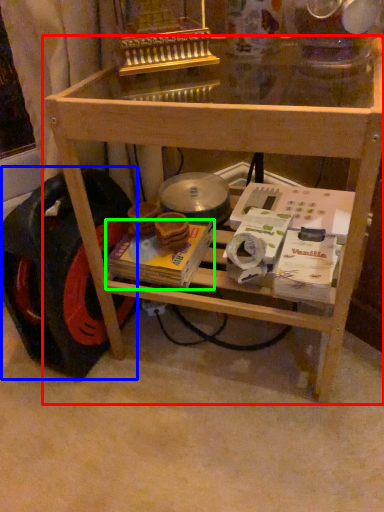
Question: Considering the real-world distances, which object is closest to table (highlighted by a red box)? wheel (highlighted by a blue box) or magazine (highlighted by a green box).

Choices:
 (A) wheel
 (B) magazine

Answer: (A)